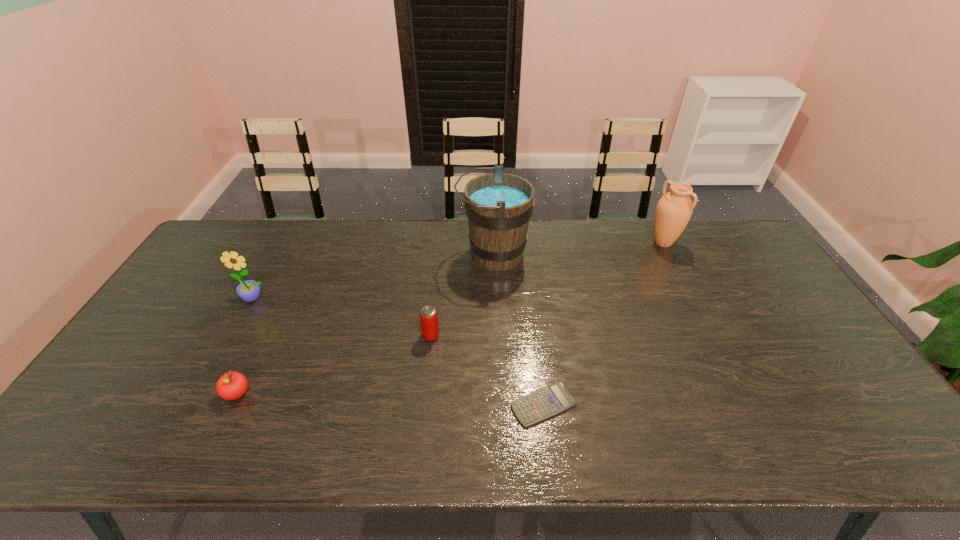
In order to click on the tallest object in this screenshot , I will do `click(498, 205)`.

At what (x,y) coordinates should I click in order to perform the action: click on urn. Please return your answer as a coordinate pair (x, y). The height and width of the screenshot is (540, 960). Looking at the image, I should click on (673, 212).

Locate an element on the screen. The width and height of the screenshot is (960, 540). the fifth shortest object is located at coordinates (673, 212).

Locate an element on the screen. The image size is (960, 540). the fourth shortest object is located at coordinates (249, 290).

Identify the location of the leftmost object. (249, 290).

Identify the location of the fourth object from right to left. (429, 323).

Where is `the third nearest object`? This screenshot has height=540, width=960. the third nearest object is located at coordinates (429, 323).

Where is `apple`? This screenshot has width=960, height=540. apple is located at coordinates (232, 385).

Where is `the second shortest object`? the second shortest object is located at coordinates (232, 385).

Locate an element on the screen. This screenshot has height=540, width=960. calculator is located at coordinates [x=555, y=398].